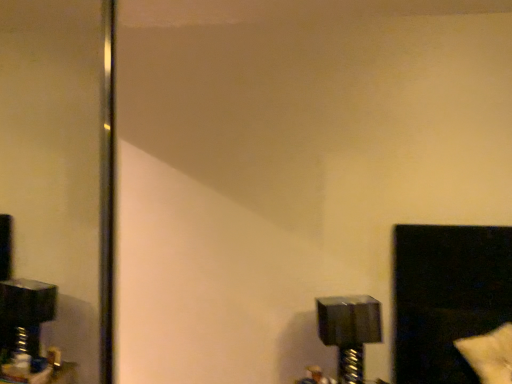
Question: Is black glossy window at lower right at the back of white fluffy pillow at lower right?

Choices:
 (A) yes
 (B) no

Answer: (A)

Question: From a real-world perspective, does white fluffy pillow at lower right stand above black glossy window at lower right?

Choices:
 (A) no
 (B) yes

Answer: (A)

Question: Does white fluffy pillow at lower right appear on the right side of black glossy window at lower right?

Choices:
 (A) no
 (B) yes

Answer: (B)

Question: From a real-world perspective, is white fluffy pillow at lower right under black glossy window at lower right?

Choices:
 (A) no
 (B) yes

Answer: (B)

Question: Is white fluffy pillow at lower right bigger than black glossy window at lower right?

Choices:
 (A) yes
 (B) no

Answer: (B)

Question: Considering their positions, is white fluffy pillow at lower right located in front of or behind metallic silver bolt at lower right?

Choices:
 (A) front
 (B) behind

Answer: (A)

Question: Considering the positions of point (508, 347) and point (335, 340), is point (508, 347) closer or farther from the camera than point (335, 340)?

Choices:
 (A) closer
 (B) farther

Answer: (A)

Question: From a real-world perspective, is white fluffy pillow at lower right positioned above or below metallic silver bolt at lower right?

Choices:
 (A) above
 (B) below

Answer: (A)

Question: Which is correct: white fluffy pillow at lower right is inside metallic silver bolt at lower right, or outside of it?

Choices:
 (A) inside
 (B) outside

Answer: (B)

Question: From the image's perspective, is metallic silver bolt at lower right located above or below black glossy window at lower right?

Choices:
 (A) above
 (B) below

Answer: (B)

Question: From a real-world perspective, is metallic silver bolt at lower right above or below black glossy window at lower right?

Choices:
 (A) below
 (B) above

Answer: (A)

Question: In terms of size, does metallic silver bolt at lower right appear bigger or smaller than black glossy window at lower right?

Choices:
 (A) big
 (B) small

Answer: (B)

Question: Is point (352, 317) positioned closer to the camera than point (406, 354)?

Choices:
 (A) farther
 (B) closer

Answer: (B)

Question: In the image, is black glossy window at lower right positioned in front of or behind metallic silver bolt at lower right?

Choices:
 (A) behind
 (B) front

Answer: (B)

Question: In terms of width, does black glossy window at lower right look wider or thinner when compared to metallic silver bolt at lower right?

Choices:
 (A) thin
 (B) wide

Answer: (B)